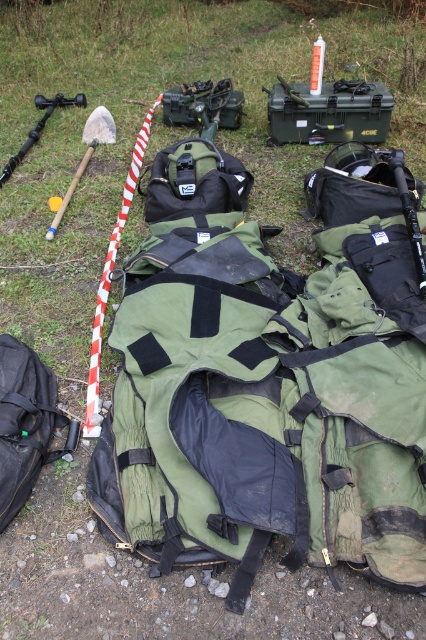
Question: Which point is closer to the camera?

Choices:
 (A) (23, 154)
 (B) (103, 128)

Answer: (A)

Question: Can you confirm if black matte backpack at lower left is thinner than matte black rifle at left?

Choices:
 (A) yes
 (B) no

Answer: (A)

Question: Which point is closer to the camera?

Choices:
 (A) (66, 204)
 (B) (210, 164)

Answer: (B)

Question: Estimate the real-world distances between objects in this image. Which object is farther from the wooden shovel at left?

Choices:
 (A) matte black rifle at left
 (B) black matte backpack at lower left
 (C) matte black backpack at center

Answer: (B)

Question: Can you confirm if green matte backpack at center is wider than black matte backpack at lower left?

Choices:
 (A) no
 (B) yes

Answer: (A)

Question: Is green matte backpack at center further to camera compared to black matte backpack at lower left?

Choices:
 (A) no
 (B) yes

Answer: (B)